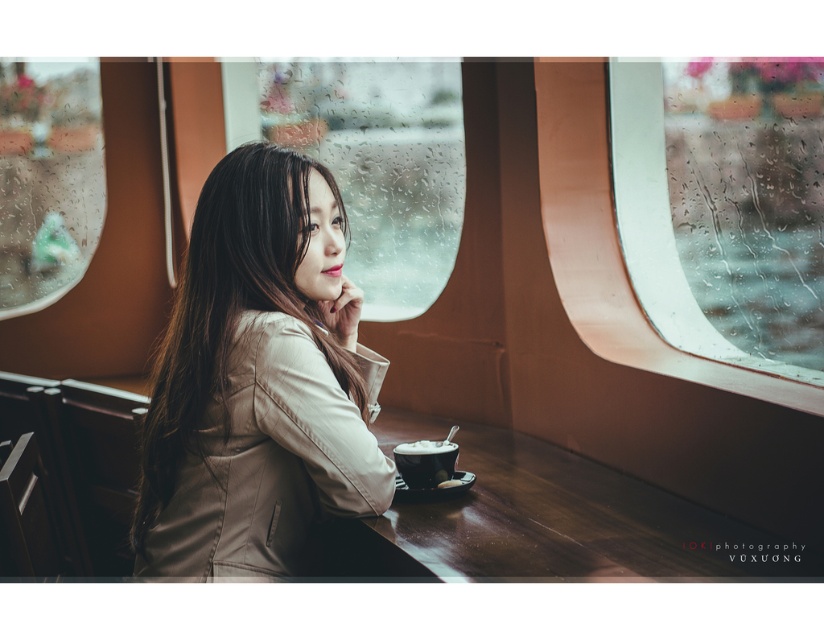
Question: Can you confirm if matte beige coat at center is positioned to the left of transparent glass train window at upper center?

Choices:
 (A) yes
 (B) no

Answer: (A)

Question: Which point is farther to the camera?

Choices:
 (A) 356,76
 (B) 815,289
 (C) 434,467
 (D) 345,378

Answer: (A)

Question: Does transparent glass train window at upper center appear on the right side of white frothy coffee at lower center?

Choices:
 (A) yes
 (B) no

Answer: (A)

Question: Is transparent glass train window at upper center closer to camera compared to white frothy coffee at lower center?

Choices:
 (A) yes
 (B) no

Answer: (A)

Question: Which point is closer to the camera taking this photo?

Choices:
 (A) (8, 131)
 (B) (656, 257)
 (C) (363, 227)
 (D) (298, 369)

Answer: (D)

Question: Which point is closer to the camera?

Choices:
 (A) transparent glass train window at upper center
 (B) matte beige coat at center
 (C) transparent glass train window at upper left

Answer: (B)